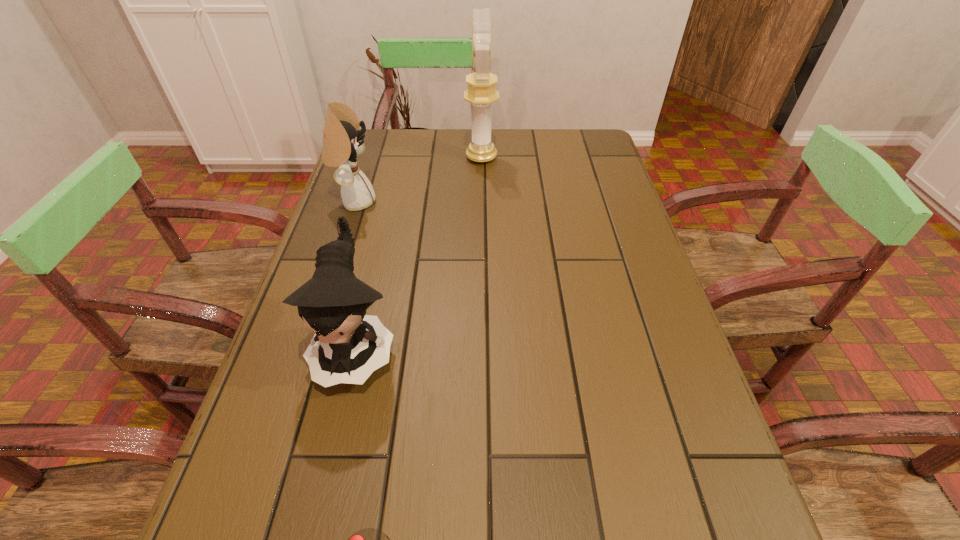
What are the coordinates of `vacant space at the far edge of the desktop` in the screenshot? It's located at (526, 134).

I want to click on free region at the left edge of the desktop, so [x=252, y=482].

Find the location of a particular element. Image resolution: width=960 pixels, height=540 pixels. free region at the right edge of the desktop is located at coordinates (652, 273).

The image size is (960, 540). Identify the location of free point at the far left corner. (410, 131).

I want to click on vacant space at the far right corner of the desktop, so click(594, 168).

This screenshot has height=540, width=960. In order to click on unoccupied position between the third nearest object and the award in this screenshot , I will do (x=419, y=179).

This screenshot has width=960, height=540. I want to click on free space that is in between the second nearest object and the tallest object, so click(419, 252).

You are a GUI agent. You are given a task and a screenshot of the screen. Output one action in this format:
    pyautogui.click(x=<x>, y=<y>)
    Task: Click on the vacant area that lies between the third farthest object and the second farthest object
    This screenshot has height=540, width=960.
    Given the screenshot: What is the action you would take?
    pyautogui.click(x=356, y=274)

Find the location of a particular element. Image resolution: width=960 pixels, height=540 pixels. empty location between the second nearest object and the third nearest object is located at coordinates (356, 274).

The height and width of the screenshot is (540, 960). Identify the location of free point between the nearer doll and the third nearest object. (356, 274).